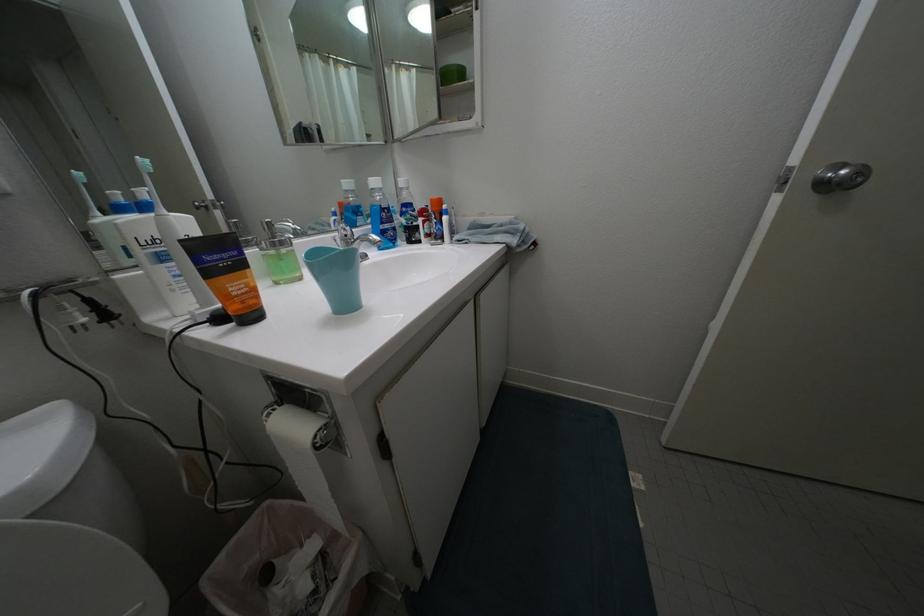
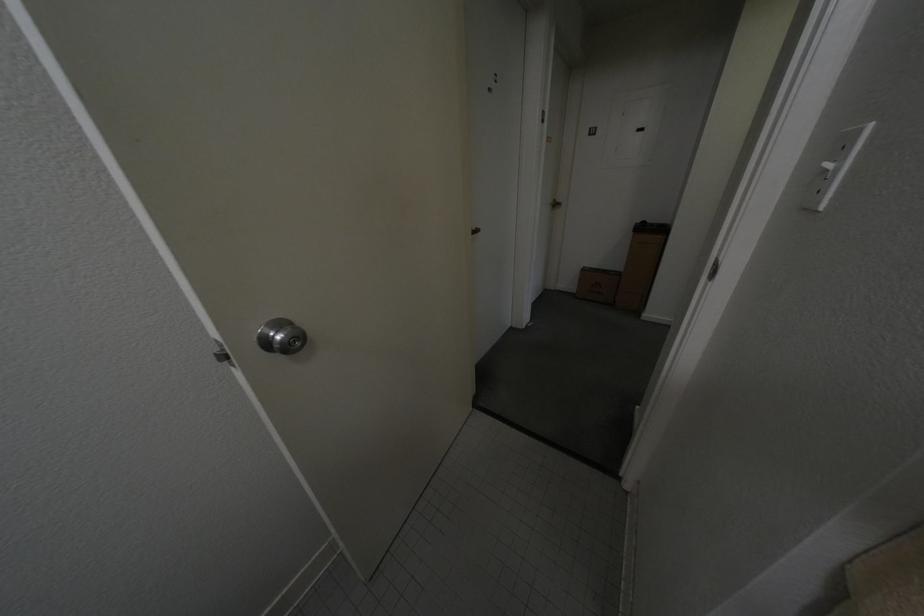
Based on the continuous images, in which direction is the camera rotating?

The camera's rotation is toward right-down.